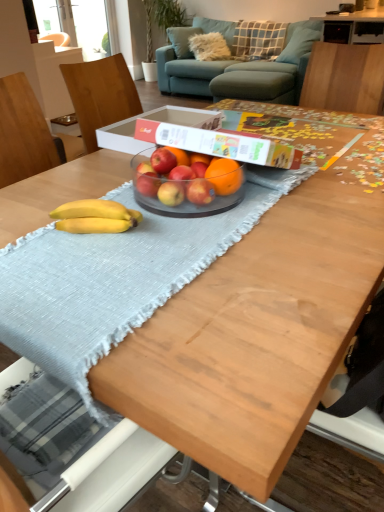
Image resolution: width=384 pixels, height=512 pixels. What are the coordinates of `vacant area that is situated to the right of red matte apple at center, which is the 2th apple in right-to-left order` in the screenshot? It's located at (253, 179).